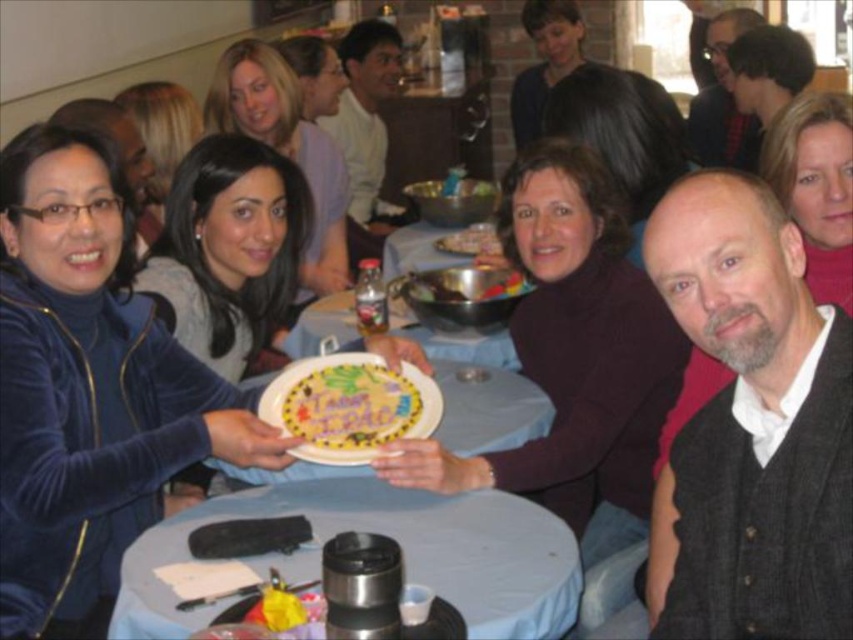
Does smooth plastic table at center appear on the left side of smooth chocolate cake at center?

Yes, smooth plastic table at center is to the left of smooth chocolate cake at center.

Who is more forward, (476, 572) or (456, 234)?

Positioned in front is point (476, 572).

Measure the distance between point (x=477, y=506) and camera.

Point (x=477, y=506) is 5.02 feet away from camera.

This screenshot has width=853, height=640. Identify the location of smooth plastic table at center. (392, 536).

Does smooth plastic table at center have a greater width compared to shiny metallic bowl at center?

Yes, smooth plastic table at center is wider than shiny metallic bowl at center.

Is smooth plastic table at center below shiny metallic bowl at center?

Yes, smooth plastic table at center is below shiny metallic bowl at center.

Who is more distant from viewer, (143, 625) or (431, 298)?

The point (431, 298) is behind.

The width and height of the screenshot is (853, 640). I want to click on smooth plastic table at center, so click(x=392, y=536).

Between smooth plastic table at center and decorative paper plate at center, which one has less height?

decorative paper plate at center is shorter.

Is smooth plastic table at center further to the viewer compared to decorative paper plate at center?

No, smooth plastic table at center is in front of decorative paper plate at center.

Is point (511, 577) closer to camera compared to point (405, 417)?

Yes, point (511, 577) is closer to viewer.

I want to click on smooth plastic table at center, so click(x=392, y=536).